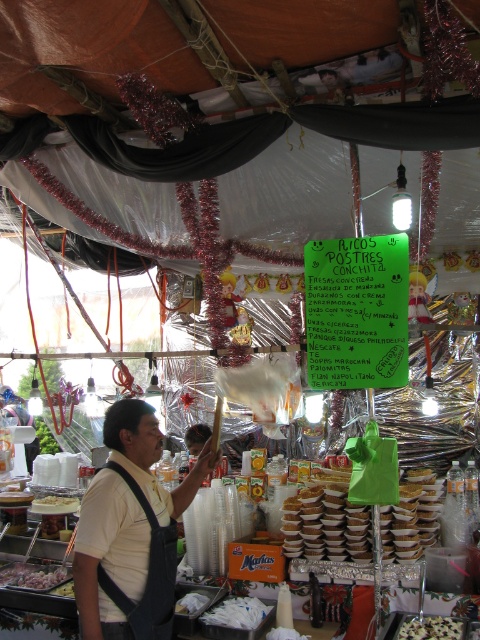
Question: Is white fabric apron at center to the right of white creamy pastry at center from the viewer's perspective?

Choices:
 (A) yes
 (B) no

Answer: (B)

Question: Can you confirm if white glossy onion at lower left is wider than white creamy pastry at center?

Choices:
 (A) no
 (B) yes

Answer: (B)

Question: Which object appears farthest from the camera in this image?

Choices:
 (A) white fabric apron at center
 (B) white glossy onion at lower left
 (C) white paper cups at center
 (D) white creamy pastry at center

Answer: (B)

Question: Which of the following is the farthest from the observer?

Choices:
 (A) (88, 536)
 (B) (435, 621)
 (C) (63, 500)

Answer: (C)

Question: Which of the following is the closest to the observer?

Choices:
 (A) white paper cups at center
 (B) white fabric apron at center

Answer: (B)

Question: Does white fabric apron at center have a smaller size compared to white matte cupcake at center?

Choices:
 (A) yes
 (B) no

Answer: (B)